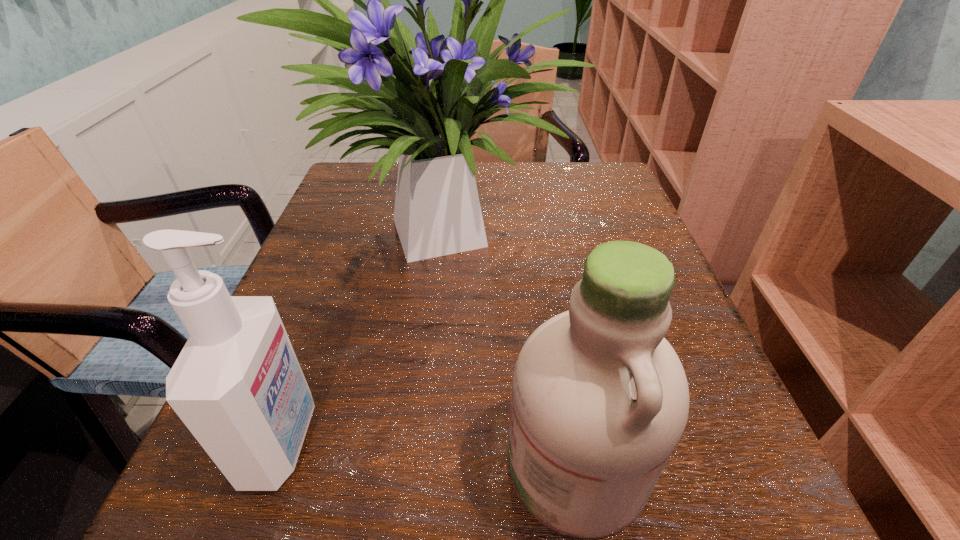
Find the location of a particular element. The height and width of the screenshot is (540, 960). the tallest object is located at coordinates (437, 212).

Where is `flower arrangement`? The height and width of the screenshot is (540, 960). flower arrangement is located at coordinates (437, 212).

The height and width of the screenshot is (540, 960). I want to click on the left cleansing agent, so click(x=237, y=385).

Where is `free space located on the front of the tallest object`? The height and width of the screenshot is (540, 960). free space located on the front of the tallest object is located at coordinates (440, 334).

At what (x,y) coordinates should I click in order to perform the action: click on free space located on the front label of the left cleansing agent. Please return your answer as a coordinate pair (x, y). Looking at the image, I should click on (549, 441).

What are the coordinates of `object that is at the far edge` in the screenshot? It's located at (437, 212).

Where is `object that is positioned at the near edge`? Image resolution: width=960 pixels, height=540 pixels. object that is positioned at the near edge is located at coordinates (237, 385).

What are the coordinates of `flower arrangement positioned at the left edge` in the screenshot? It's located at (437, 212).

At what (x,y) coordinates should I click in order to perform the action: click on cleansing agent that is at the left edge. Please return your answer as a coordinate pair (x, y). The image size is (960, 540). Looking at the image, I should click on (237, 385).

I want to click on object that is at the right edge, so click(437, 212).